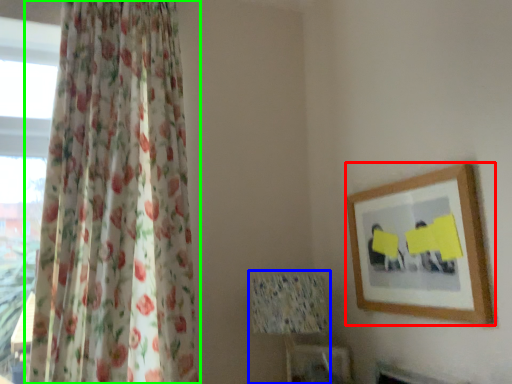
Question: Based on their relative distances, which object is nearer to picture frame (highlighted by a red box)? Choose from table lamp (highlighted by a blue box) and curtain (highlighted by a green box).

Choices:
 (A) table lamp
 (B) curtain

Answer: (A)